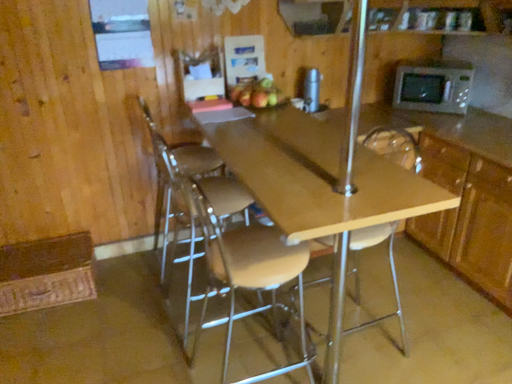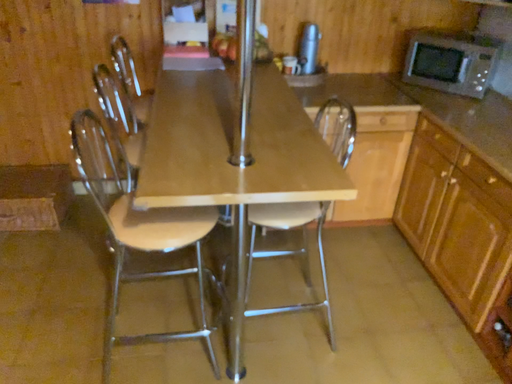
Question: How did the camera likely rotate when shooting the video?

Choices:
 (A) rotated left
 (B) rotated right

Answer: (A)